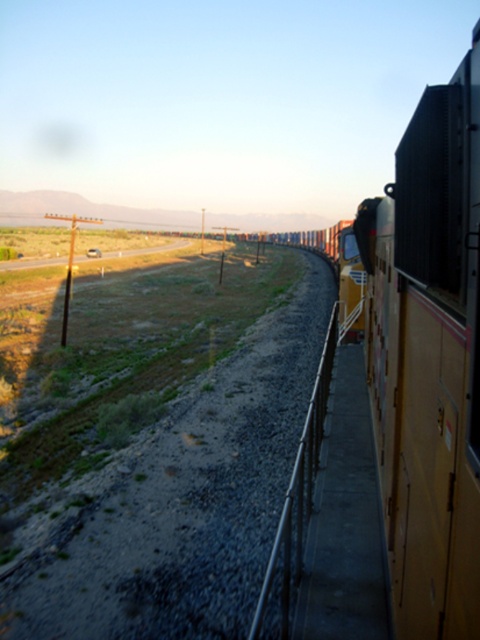
Question: In this image, where is metal/rusty rail at center located relative to transparent glass train window at right?

Choices:
 (A) right
 (B) left

Answer: (B)

Question: Which is nearer to the metal/rusty rail at center?

Choices:
 (A) transparent glass train window at right
 (B) metallic brown train car at right

Answer: (B)

Question: In this image, where is metal/rusty rail at center located relative to transparent glass train window at right?

Choices:
 (A) above
 (B) below

Answer: (B)

Question: From the image, what is the correct spatial relationship of metal/rusty rail at center in relation to transparent glass train window at right?

Choices:
 (A) above
 (B) below

Answer: (B)

Question: Among these objects, which one is farthest from the camera?

Choices:
 (A) metal/rusty rail at center
 (B) transparent glass train window at right
 (C) metallic brown train car at right

Answer: (B)

Question: Based on their relative distances, which object is farther from the metallic brown train car at right?

Choices:
 (A) transparent glass train window at right
 (B) metal/rusty rail at center

Answer: (A)